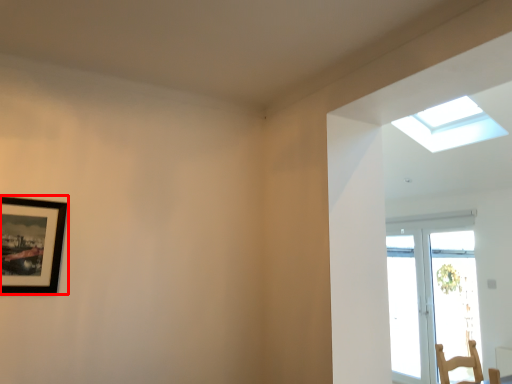
Question: From the image's perspective, what is the correct spatial positioning of picture frame (annotated by the red box) in reference to window?

Choices:
 (A) above
 (B) below

Answer: (B)